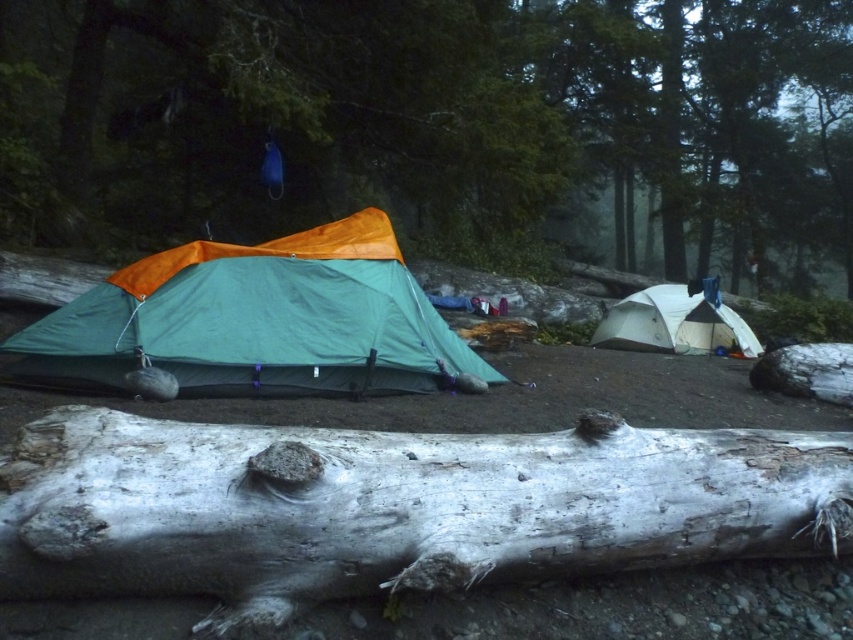
Who is more forward, (161, 124) or (123, 298)?

Positioned in front is point (123, 298).

Locate an element on the screen. The width and height of the screenshot is (853, 640). smooth gray log at center is located at coordinates (432, 120).

Does white rough bark log at lower center have a lesser height compared to white matte tent at center?

Correct, white rough bark log at lower center is not as tall as white matte tent at center.

Does white rough bark log at lower center have a greater height compared to white matte tent at center?

No, white rough bark log at lower center is not taller than white matte tent at center.

You are a GUI agent. You are given a task and a screenshot of the screen. Output one action in this format:
    pyautogui.click(x=<x>, y=<y>)
    Task: Click on the white rough bark log at lower center
    The width and height of the screenshot is (853, 640).
    Given the screenshot: What is the action you would take?
    pyautogui.click(x=393, y=506)

Where is `white rough bark log at lower center`? Image resolution: width=853 pixels, height=640 pixels. white rough bark log at lower center is located at coordinates (393, 506).

Who is positioned more to the left, green fabric tent at center or white matte tent at center?

From the viewer's perspective, green fabric tent at center appears more on the left side.

Can you confirm if green fabric tent at center is smaller than white matte tent at center?

No, green fabric tent at center is not smaller than white matte tent at center.

Where is `green fabric tent at center`? The height and width of the screenshot is (640, 853). green fabric tent at center is located at coordinates (258, 317).